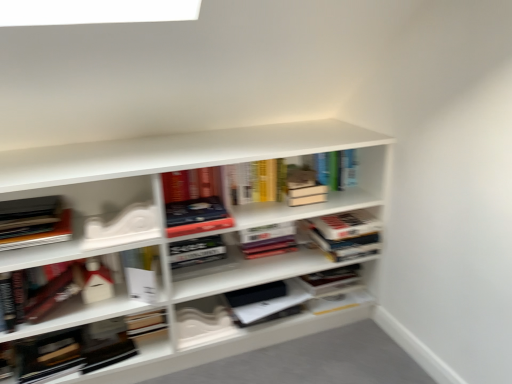
Question: Considering the relative sizes of hardcover book at center, which is the first book in right-to-left order, and white matte bookshelf at center in the image provided, is hardcover book at center, which is the first book in right-to-left order, wider than white matte bookshelf at center?

Choices:
 (A) no
 (B) yes

Answer: (A)

Question: From a real-world perspective, is hardcover book at center, which is counted as the sixth book, starting from the left, physically below white matte bookshelf at center?

Choices:
 (A) no
 (B) yes

Answer: (A)

Question: Does hardcover book at center, which is the first book in right-to-left order, have a smaller size compared to white matte bookshelf at center?

Choices:
 (A) yes
 (B) no

Answer: (A)

Question: Does hardcover book at center, which is counted as the sixth book, starting from the left, touch white matte bookshelf at center?

Choices:
 (A) no
 (B) yes

Answer: (A)

Question: From a real-world perspective, is hardcover book at center, which is the first book in right-to-left order, on white matte bookshelf at center?

Choices:
 (A) no
 (B) yes

Answer: (B)

Question: Based on their positions, is hardcover book at center, which is the third book from right to left, located to the left or right of white paper at center, which appears as the fourth book when viewed from the right?

Choices:
 (A) left
 (B) right

Answer: (B)

Question: From a real-world perspective, relative to white paper at center, which is the third book from left to right, is hardcover book at center, arranged as the 4th book when viewed from the left, vertically above or below?

Choices:
 (A) below
 (B) above

Answer: (A)

Question: In terms of size, does hardcover book at center, arranged as the 4th book when viewed from the left, appear bigger or smaller than white paper at center, which appears as the fourth book when viewed from the right?

Choices:
 (A) big
 (B) small

Answer: (A)

Question: Is hardcover book at center, which is the third book from right to left, in front of or behind white paper at center, which is the third book from left to right, in the image?

Choices:
 (A) front
 (B) behind

Answer: (B)

Question: From the image's perspective, relative to white matte box at left, acting as the 2th book starting from the left, is matte black book at left, which is the first book in left-to-right order, above or below?

Choices:
 (A) below
 (B) above

Answer: (B)

Question: Is matte black book at left, placed as the 6th book when sorted from right to left, in front of or behind white matte box at left, acting as the 2th book starting from the left, in the image?

Choices:
 (A) behind
 (B) front

Answer: (B)

Question: Based on their positions, is matte black book at left, placed as the 6th book when sorted from right to left, located to the left or right of white matte box at left, the fifth book viewed from the right?

Choices:
 (A) left
 (B) right

Answer: (A)

Question: Looking at the image, does matte black book at left, placed as the 6th book when sorted from right to left, seem bigger or smaller compared to white matte box at left, the fifth book viewed from the right?

Choices:
 (A) big
 (B) small

Answer: (B)

Question: In terms of width, does white matte bookshelf at center look wider or thinner when compared to white matte box at left, the fifth book viewed from the right?

Choices:
 (A) thin
 (B) wide

Answer: (B)

Question: From the image's perspective, is white matte bookshelf at center above or below white matte box at left, the fifth book viewed from the right?

Choices:
 (A) above
 (B) below

Answer: (A)